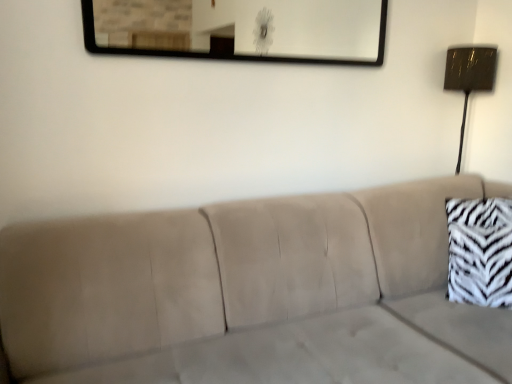
Question: Which direction should I rotate to look at metallic rectangular mirror at upper center?

Choices:
 (A) left
 (B) right

Answer: (B)

Question: Considering the relative sizes of beige fabric couch at center and metallic rectangular mirror at upper center in the image provided, is beige fabric couch at center taller than metallic rectangular mirror at upper center?

Choices:
 (A) no
 (B) yes

Answer: (B)

Question: Is beige fabric couch at center wider than metallic rectangular mirror at upper center?

Choices:
 (A) no
 (B) yes

Answer: (B)

Question: Is beige fabric couch at center touching metallic rectangular mirror at upper center?

Choices:
 (A) yes
 (B) no

Answer: (B)

Question: Can you confirm if beige fabric couch at center is positioned to the left of metallic rectangular mirror at upper center?

Choices:
 (A) yes
 (B) no

Answer: (A)

Question: Is beige fabric couch at center facing away from metallic rectangular mirror at upper center?

Choices:
 (A) no
 (B) yes

Answer: (A)

Question: Considering the relative sizes of beige fabric couch at center and metallic rectangular mirror at upper center in the image provided, is beige fabric couch at center bigger than metallic rectangular mirror at upper center?

Choices:
 (A) no
 (B) yes

Answer: (B)

Question: Considering the relative sizes of metallic rectangular mirror at upper center and zebra print fabric pillow at right in the image provided, is metallic rectangular mirror at upper center bigger than zebra print fabric pillow at right?

Choices:
 (A) no
 (B) yes

Answer: (A)

Question: From a real-world perspective, is metallic rectangular mirror at upper center physically below zebra print fabric pillow at right?

Choices:
 (A) yes
 (B) no

Answer: (B)

Question: Could you tell me if metallic rectangular mirror at upper center is turned towards zebra print fabric pillow at right?

Choices:
 (A) yes
 (B) no

Answer: (B)

Question: Does metallic rectangular mirror at upper center appear on the right side of zebra print fabric pillow at right?

Choices:
 (A) no
 (B) yes

Answer: (A)

Question: Can you confirm if metallic rectangular mirror at upper center is wider than zebra print fabric pillow at right?

Choices:
 (A) yes
 (B) no

Answer: (B)

Question: Are metallic rectangular mirror at upper center and zebra print fabric pillow at right far apart?

Choices:
 (A) no
 (B) yes

Answer: (B)

Question: Is metallic rectangular mirror at upper center positioned in front of metallic gold lamp at right?

Choices:
 (A) yes
 (B) no

Answer: (A)